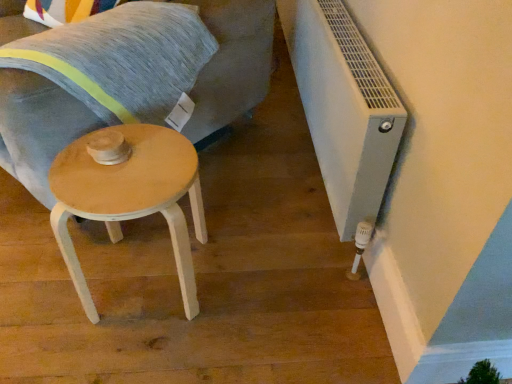
The height and width of the screenshot is (384, 512). Describe the element at coordinates (128, 194) in the screenshot. I see `light wood/wooden stool at lower left` at that location.

I want to click on textured gray pillow at upper left, so click(121, 60).

How many degrees apart are the facing directions of light wood swivel chair at center and light wood/wooden stool at lower left?

The angular difference between light wood swivel chair at center and light wood/wooden stool at lower left is 48.4 degrees.

Is light wood swivel chair at center closer to camera compared to light wood/wooden stool at lower left?

Yes, light wood swivel chair at center is closer to the camera.

Which is in front, point (58, 147) or point (65, 185)?

Point (65, 185)

Between light wood swivel chair at center and light wood/wooden stool at lower left, which one appears on the right side from the viewer's perspective?

light wood/wooden stool at lower left.

Is white plastic radiator at lower right at the back of light wood swivel chair at center?

light wood swivel chair at center does not have its back to white plastic radiator at lower right.

From a real-world perspective, between light wood swivel chair at center and white plastic radiator at lower right, who is vertically lower?

white plastic radiator at lower right.

Is point (27, 94) closer to camera compared to point (288, 39)?

That is True.

Is light wood swivel chair at center shorter than white plastic radiator at lower right?

In fact, light wood swivel chair at center may be taller than white plastic radiator at lower right.

Does white plastic radiator at lower right have a lesser height compared to light wood swivel chair at center?

Correct, white plastic radiator at lower right is not as tall as light wood swivel chair at center.

From the image's perspective, which one is positioned higher, white plastic radiator at lower right or light wood swivel chair at center?

light wood swivel chair at center appears higher in the image.

How many degrees apart are the facing directions of white plastic radiator at lower right and light wood swivel chair at center?

The facing directions of white plastic radiator at lower right and light wood swivel chair at center are 45.6 degrees apart.

Which object is positioned more to the left, white plastic radiator at lower right or light wood swivel chair at center?

light wood swivel chair at center.

Considering the relative positions of light wood/wooden stool at lower left and light wood swivel chair at center in the image provided, is light wood/wooden stool at lower left to the right of light wood swivel chair at center from the viewer's perspective?

Yes.

From their relative heights in the image, would you say light wood/wooden stool at lower left is taller or shorter than light wood swivel chair at center?

Clearly, light wood/wooden stool at lower left is shorter compared to light wood swivel chair at center.

Identify the location of swivel chair that is above the light wood/wooden stool at lower left (from a real-world perspective). (232, 63).

At what (x,y) coordinates should I click in order to perform the action: click on air conditioning that is above the textured gray pillow at upper left (from the image's perspective). Please return your answer as a coordinate pair (x, y). The width and height of the screenshot is (512, 384). Looking at the image, I should click on (344, 112).

Considering the sizes of textured gray pillow at upper left and white plastic radiator at lower right in the image, is textured gray pillow at upper left taller or shorter than white plastic radiator at lower right?

In the image, textured gray pillow at upper left appears to be shorter than white plastic radiator at lower right.

Between textured gray pillow at upper left and white plastic radiator at lower right, which one is positioned in front?

A: Positioned in front is white plastic radiator at lower right.

Which is correct: textured gray pillow at upper left is inside white plastic radiator at lower right, or outside of it?

textured gray pillow at upper left is spatially situated outside white plastic radiator at lower right.

From the image's perspective, is light wood/wooden stool at lower left over textured gray pillow at upper left?

Actually, light wood/wooden stool at lower left appears below textured gray pillow at upper left in the image.

Which object is closer to the camera, light wood/wooden stool at lower left or textured gray pillow at upper left?

Positioned in front is light wood/wooden stool at lower left.

In the scene shown: Is textured gray pillow at upper left at the back of light wood/wooden stool at lower left?

light wood/wooden stool at lower left is not turned away from textured gray pillow at upper left.

Between light wood swivel chair at center and textured gray pillow at upper left, which one is positioned in front?

light wood swivel chair at center is closer to the camera.

Is textured gray pillow at upper left completely or partially inside light wood swivel chair at center?

Absolutely, textured gray pillow at upper left is inside light wood swivel chair at center.

At what (x,y) coordinates should I click in order to perform the action: click on pillow that is behind the light wood swivel chair at center. Please return your answer as a coordinate pair (x, y). Looking at the image, I should click on (121, 60).

The image size is (512, 384). In order to click on stool below the light wood swivel chair at center (from the image's perspective) in this screenshot , I will do `click(128, 194)`.

You are a GUI agent. You are given a task and a screenshot of the screen. Output one action in this format:
    pyautogui.click(x=<x>, y=<y>)
    Task: Click on the air conditioning behind the light wood swivel chair at center
    This screenshot has height=384, width=512.
    Given the screenshot: What is the action you would take?
    pyautogui.click(x=344, y=112)

From the image, which object appears to be nearer to light wood/wooden stool at lower left, light wood swivel chair at center or white plastic radiator at lower right?

light wood swivel chair at center lies closer to light wood/wooden stool at lower left than the other object.

Estimate the real-world distances between objects in this image. Which object is closer to light wood/wooden stool at lower left, light wood swivel chair at center or textured gray pillow at upper left?

textured gray pillow at upper left is positioned closer to the anchor light wood/wooden stool at lower left.

From the image, which object appears to be nearer to white plastic radiator at lower right, light wood swivel chair at center or textured gray pillow at upper left?

The object closer to white plastic radiator at lower right is light wood swivel chair at center.

Estimate the real-world distances between objects in this image. Which object is closer to textured gray pillow at upper left, light wood/wooden stool at lower left or white plastic radiator at lower right?

Based on the image, light wood/wooden stool at lower left appears to be nearer to textured gray pillow at upper left.

Which object lies further to the anchor point white plastic radiator at lower right, light wood/wooden stool at lower left or textured gray pillow at upper left?

The object further to white plastic radiator at lower right is textured gray pillow at upper left.

When comparing their distances from textured gray pillow at upper left, does white plastic radiator at lower right or light wood/wooden stool at lower left seem closer?

Among the two, light wood/wooden stool at lower left is located nearer to textured gray pillow at upper left.

Based on their spatial positions, is textured gray pillow at upper left or light wood/wooden stool at lower left further from white plastic radiator at lower right?

Based on the image, textured gray pillow at upper left appears to be further to white plastic radiator at lower right.

Which object lies nearer to the anchor point light wood swivel chair at center, white plastic radiator at lower right or light wood/wooden stool at lower left?

Based on the image, white plastic radiator at lower right appears to be nearer to light wood swivel chair at center.

What are the coordinates of `pillow between light wood swivel chair at center and light wood/wooden stool at lower left vertically` in the screenshot? It's located at (121, 60).

Find the location of a particular element. Image resolution: width=512 pixels, height=384 pixels. stool between light wood swivel chair at center and white plastic radiator at lower right is located at coordinates (128, 194).

This screenshot has height=384, width=512. What are the coordinates of `pillow between light wood swivel chair at center and white plastic radiator at lower right in the horizontal direction` in the screenshot? It's located at (121, 60).

The height and width of the screenshot is (384, 512). I want to click on stool located between textured gray pillow at upper left and white plastic radiator at lower right in the left-right direction, so click(x=128, y=194).